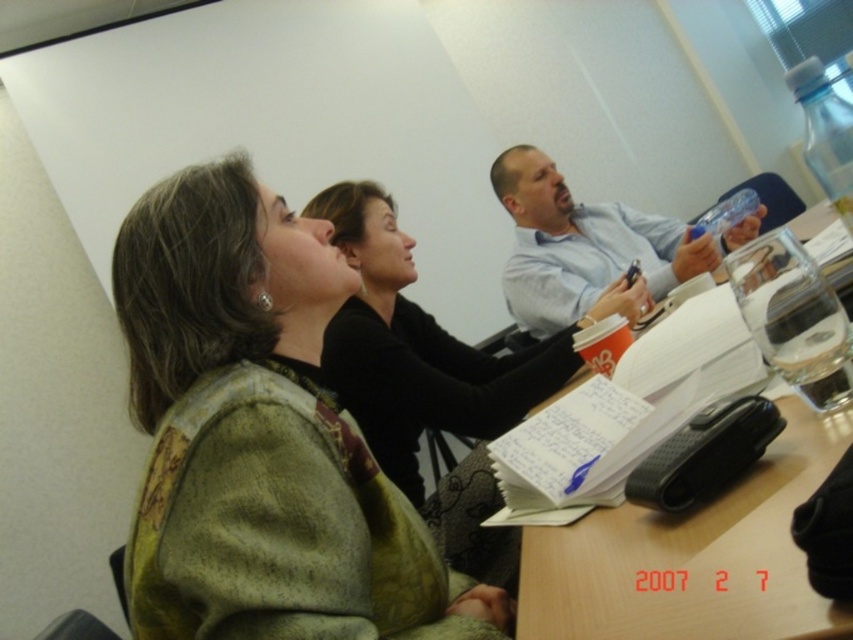
You are standing at the entrance of the meeting room and see two points marked on the wall. The first point is at coordinates point (674,561) and the second point is at point (554,179). Which point is closer to you?

Point (674,561) is in front of point (554,179), so it is closer to you.

You are attending a meeting and need to pass a document to the person wearing the blue shirt at upper center. The green textured sweater at center is in your way. Can you pass the document over their head without bending?

The green textured sweater at center is closer to the viewer than the blue shirt at upper center. Since the green textured sweater at center is in front, you can pass the document over their head to reach the blue shirt at upper center.

You are a person standing at the entrance of the meeting room. You see the green textured sweater at center and the blue shirt at upper center. How far apart are these two items from each other?

The green textured sweater at center is 3.98 feet from the blue shirt at upper center.